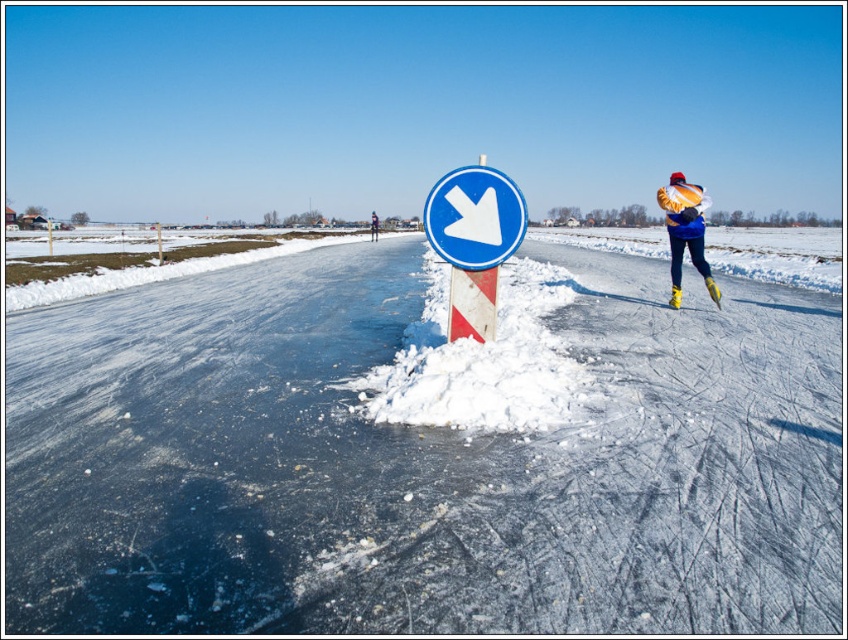
You are an ice skater looking at the traffic signpost. You see the white plastic arrow at center and the blue woolen hat at upper center. Which object is closer to you?

The white plastic arrow at center is closer to you because it is in front of the blue woolen hat at upper center.

You are an ice skater on the frozen road and want to move towards the direction indicated by the traffic sign. There are two points marked on the ice, point A at coordinates point A is point (639, 467) and point B at coordinates point B is point (462, 216). Which point should you aim for first if you want to follow the direction of the sign?

Point A at coordinates point A is point (639, 467) is in front of point B at coordinates point B is point (462, 216), so you should aim for point A first to follow the direction indicated by the traffic sign.